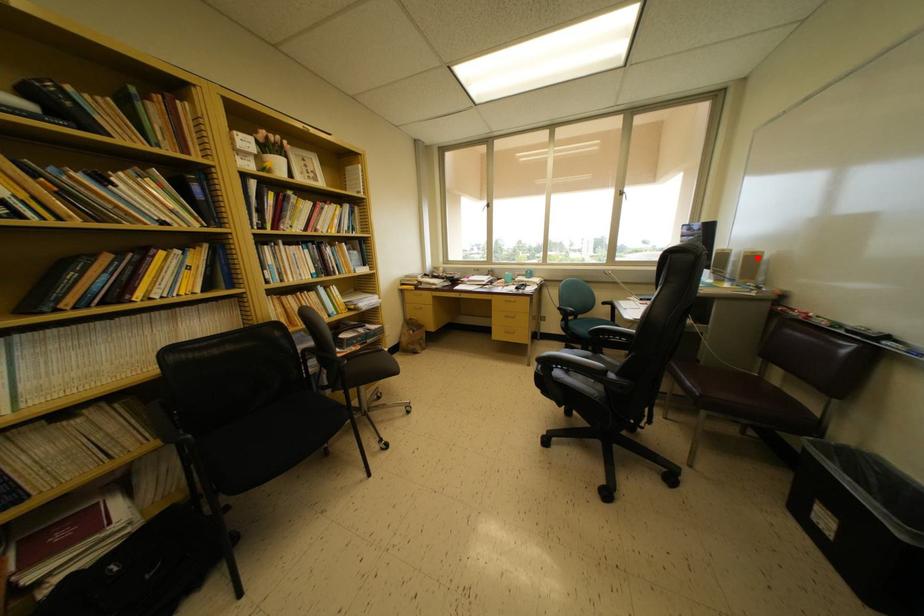
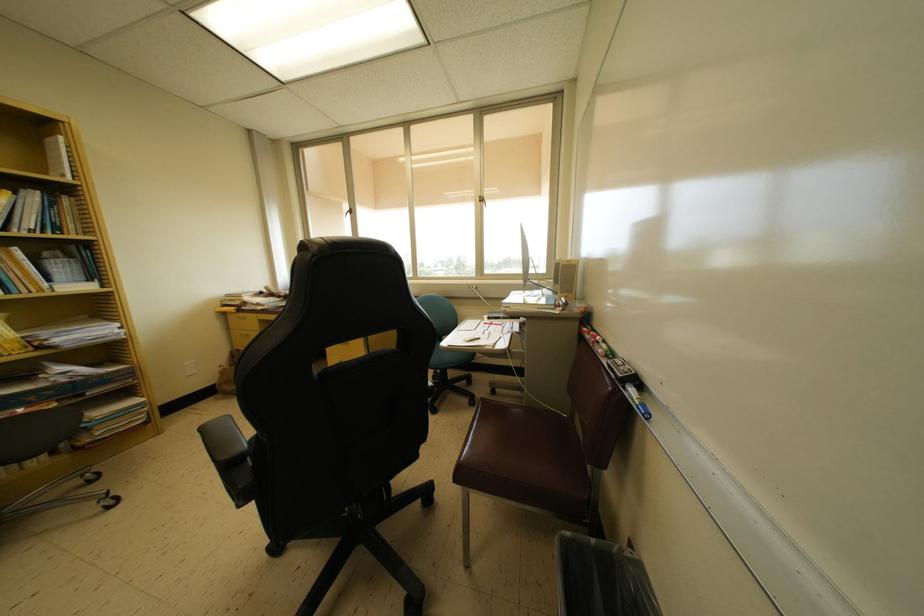
Find the pixel in the second image that matches the highlighted location in the first image.

(572, 265)